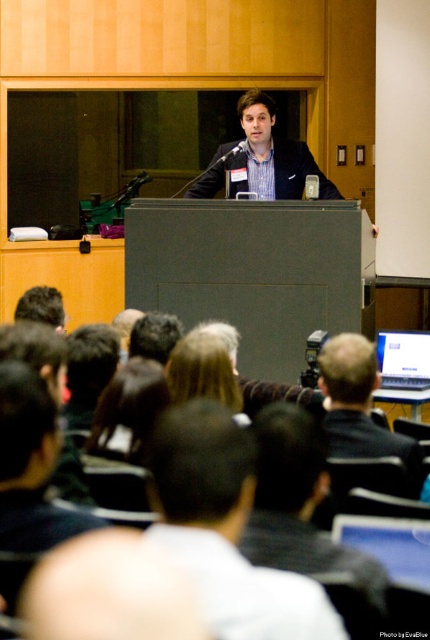
Question: Considering the real-world distances, which object is farthest from the blonde hair at center?

Choices:
 (A) dark brown hair at center
 (B) matte black laptop at center

Answer: (A)

Question: Which point is farther to the camera?

Choices:
 (A) black fabric jacket at center
 (B) black fabric shirt at lower center
 (C) matte black laptop at center

Answer: (C)

Question: Which of the following is the closest to the observer?

Choices:
 (A) black fabric shirt at lower center
 (B) matte black laptop at center

Answer: (A)

Question: Considering the relative positions of matte black laptop at center and dark brown hair at center in the image provided, where is matte black laptop at center located with respect to dark brown hair at center?

Choices:
 (A) below
 (B) above

Answer: (A)

Question: Is black fabric shirt at lower center smaller than blonde hair at center?

Choices:
 (A) no
 (B) yes

Answer: (A)

Question: Can you confirm if black fabric jacket at center is bigger than matte black laptop at center?

Choices:
 (A) yes
 (B) no

Answer: (B)